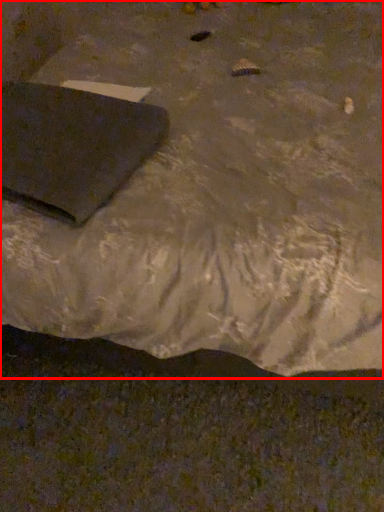
Question: Observing the image, what is the correct spatial positioning of furniture (annotated by the red box) in reference to pad?

Choices:
 (A) right
 (B) left

Answer: (A)